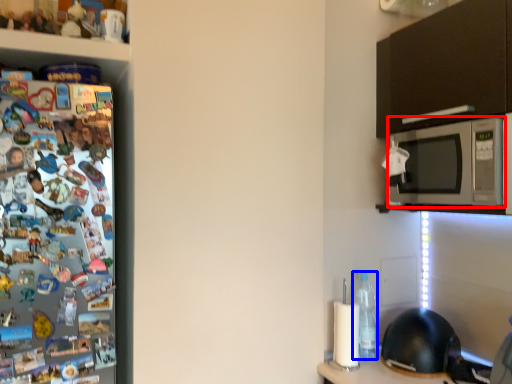
Question: Which object appears closest to the camera in this image, microwave oven (highlighted by a red box) or bottle (highlighted by a blue box)?

Choices:
 (A) microwave oven
 (B) bottle

Answer: (A)